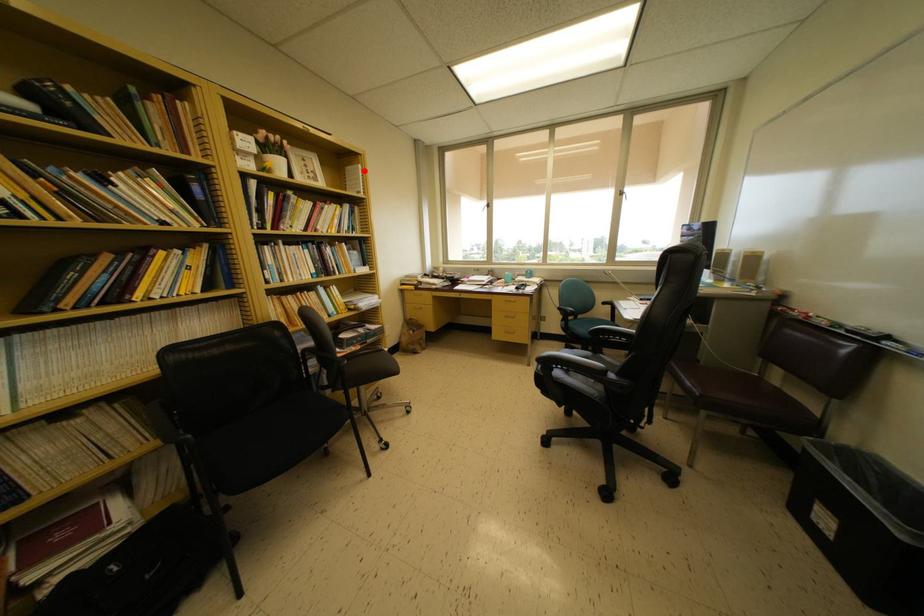
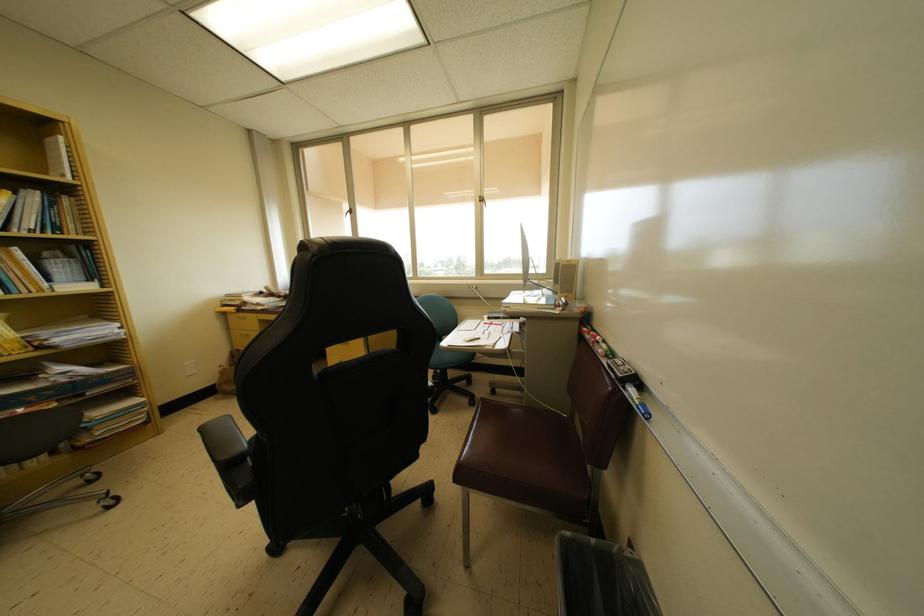
The point at the highlighted location is marked in the first image. Where is the corresponding point in the second image?

(65, 143)